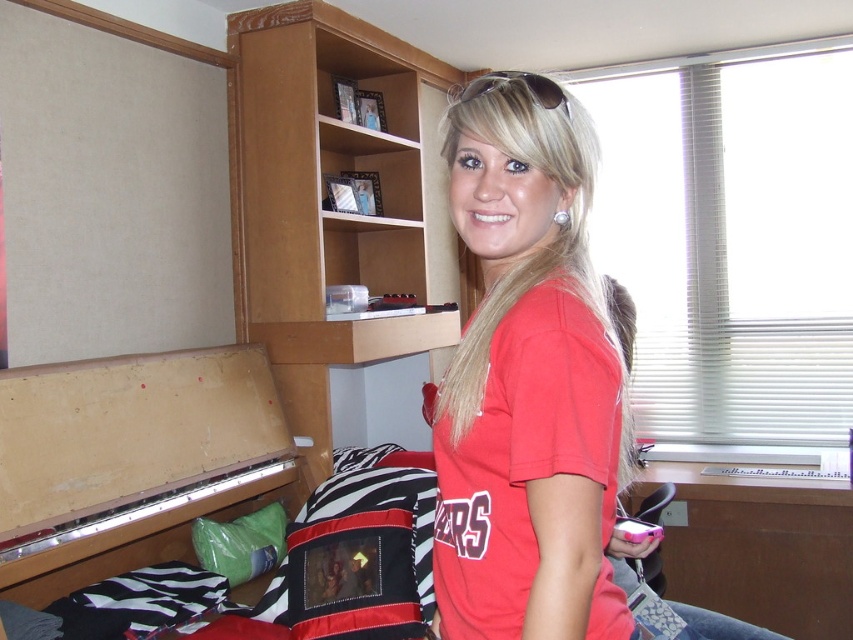
You are a photographer setting up a shot of the dorm room. You have two points marked on your camera screen at coordinates point (453,188) and point (405,124). Which point is closer to you?

Point (453,188) is closer to the viewer than point (405,124).